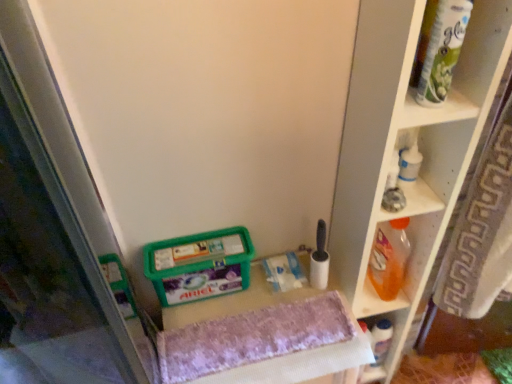
Question: Is green plastic container at lower center completely or partially outside of white plastic bottle at lower right, positioned as the 2th shelf in top-to-bottom order?

Choices:
 (A) yes
 (B) no

Answer: (A)

Question: Does green plastic container at lower center appear on the left side of white plastic bottle at lower right, the 1th shelf in the bottom-to-top sequence?

Choices:
 (A) yes
 (B) no

Answer: (A)

Question: Is green plastic container at lower center smaller than white plastic bottle at lower right, positioned as the 2th shelf in top-to-bottom order?

Choices:
 (A) yes
 (B) no

Answer: (B)

Question: Is green plastic container at lower center aimed at white plastic bottle at lower right, the 1th shelf in the bottom-to-top sequence?

Choices:
 (A) no
 (B) yes

Answer: (A)

Question: From the image's perspective, is green plastic container at lower center located beneath white plastic bottle at lower right, the 1th shelf in the bottom-to-top sequence?

Choices:
 (A) no
 (B) yes

Answer: (A)

Question: Looking at the image, does orange plastic bottle at right seem bigger or smaller compared to white plastic bottle at lower right, positioned as the 2th shelf in top-to-bottom order?

Choices:
 (A) small
 (B) big

Answer: (B)

Question: In the image, is orange plastic bottle at right on the left side or the right side of white plastic bottle at lower right, the 1th shelf in the bottom-to-top sequence?

Choices:
 (A) right
 (B) left

Answer: (B)

Question: Choose the correct answer: Is orange plastic bottle at right inside white plastic bottle at lower right, the 1th shelf in the bottom-to-top sequence, or outside it?

Choices:
 (A) outside
 (B) inside

Answer: (A)

Question: Is orange plastic bottle at right wider or thinner than white plastic bottle at lower right, positioned as the 2th shelf in top-to-bottom order?

Choices:
 (A) thin
 (B) wide

Answer: (B)

Question: Is purple fabric vanity at center to the left or to the right of white plastic bottle at lower right, positioned as the 2th shelf in top-to-bottom order, in the image?

Choices:
 (A) left
 (B) right

Answer: (A)

Question: From a real-world perspective, is purple fabric vanity at center positioned above or below white plastic bottle at lower right, positioned as the 2th shelf in top-to-bottom order?

Choices:
 (A) below
 (B) above

Answer: (B)

Question: Choose the correct answer: Is purple fabric vanity at center inside white plastic bottle at lower right, the 1th shelf in the bottom-to-top sequence, or outside it?

Choices:
 (A) outside
 (B) inside

Answer: (A)

Question: Is point (305, 251) positioned closer to the camera than point (367, 367)?

Choices:
 (A) farther
 (B) closer

Answer: (B)

Question: From the image's perspective, is green matte paper towel tube at upper right located above or below orange plastic bottle at right?

Choices:
 (A) above
 (B) below

Answer: (A)

Question: Is green matte paper towel tube at upper right bigger or smaller than orange plastic bottle at right?

Choices:
 (A) big
 (B) small

Answer: (B)